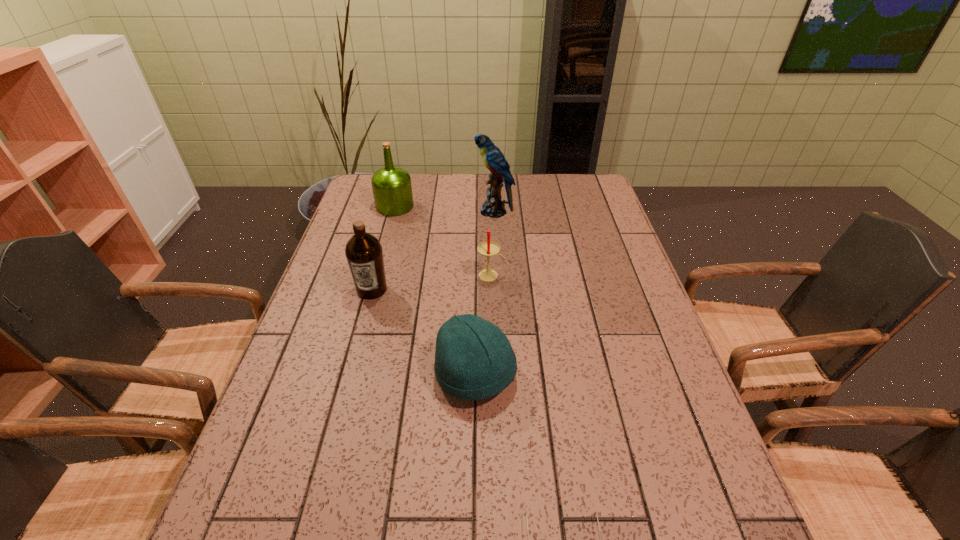
Locate an element on the screen. This screenshot has width=960, height=540. blank space located on the left of the candle is located at coordinates (412, 275).

Image resolution: width=960 pixels, height=540 pixels. Identify the location of free space located 0.050m on the back of the beanie. (476, 328).

At what (x,y) coordinates should I click in order to perform the action: click on parrot positioned at the far edge. Please return your answer as a coordinate pair (x, y). Looking at the image, I should click on (494, 160).

At what (x,y) coordinates should I click in order to perform the action: click on olive oil that is at the far edge. Please return your answer as a coordinate pair (x, y). Looking at the image, I should click on (392, 190).

Where is `object present at the far left corner`? object present at the far left corner is located at coordinates click(392, 190).

Locate an element on the screen. vacant space at the far edge of the desktop is located at coordinates (552, 176).

The height and width of the screenshot is (540, 960). Find the location of `free location at the left edge of the desktop`. free location at the left edge of the desktop is located at coordinates (279, 459).

Image resolution: width=960 pixels, height=540 pixels. In the image, there is a desktop. Find the location of `vacant space at the right edge`. vacant space at the right edge is located at coordinates (634, 467).

What are the coordinates of `vacant position at the far left corner of the desktop` in the screenshot? It's located at (367, 197).

You are a GUI agent. You are given a task and a screenshot of the screen. Output one action in this format:
    pyautogui.click(x=<x>, y=<y>)
    Task: Click on the vacant space at the far right corner
    This screenshot has width=960, height=540.
    Given the screenshot: What is the action you would take?
    pyautogui.click(x=572, y=174)